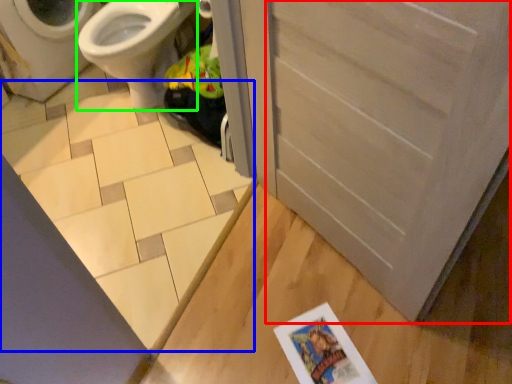
Question: Which object is the closest to the screen door (highlighted by a red box)? Choose among these: tile (highlighted by a blue box) or bidet (highlighted by a green box).

Choices:
 (A) tile
 (B) bidet

Answer: (A)